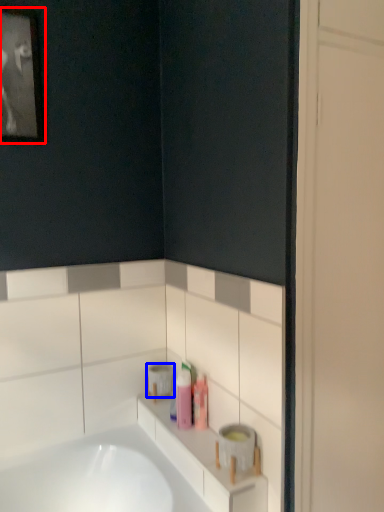
Question: Which object is closer to the camera taking this photo, picture frame (highlighted by a red box) or toilet paper (highlighted by a blue box)?

Choices:
 (A) picture frame
 (B) toilet paper

Answer: (A)